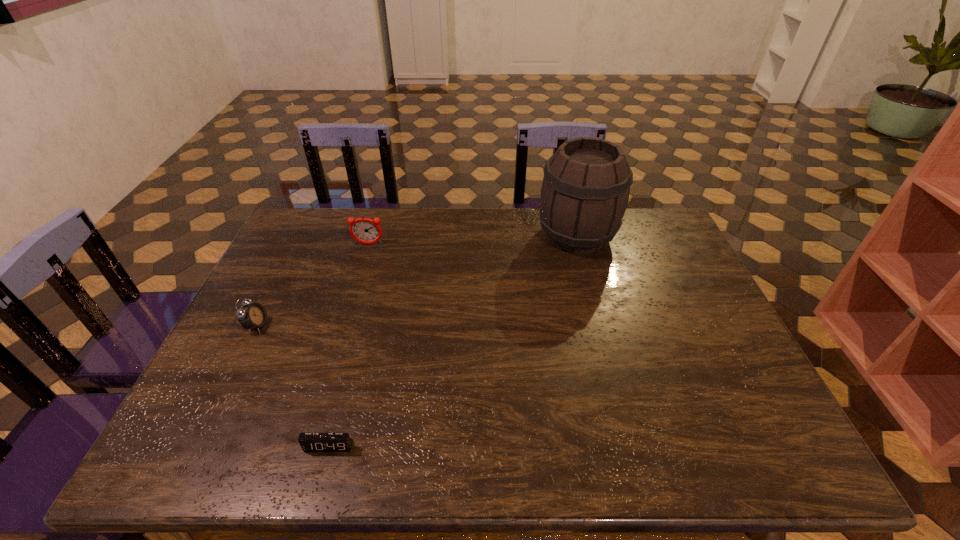
This screenshot has width=960, height=540. Identify the location of free space between the third farthest object and the tallest object. (417, 281).

Locate an element on the screen. This screenshot has height=540, width=960. object that is the closest to the tallest object is located at coordinates (364, 230).

Locate an element on the screen. This screenshot has height=540, width=960. object that can be found as the closest to the shortest object is located at coordinates [x=252, y=316].

Locate an element on the screen. This screenshot has width=960, height=540. the second closest alarm clock relative to the tallest alarm clock is located at coordinates (310, 442).

Where is `alarm clock that is the second closest to the rightmost object`? alarm clock that is the second closest to the rightmost object is located at coordinates (310, 442).

Identify the location of vacant space that satisfies the following two spatial constraints: 1. on the front-facing side of the farthest alarm clock; 2. on the face of the second farthest alarm clock. (344, 326).